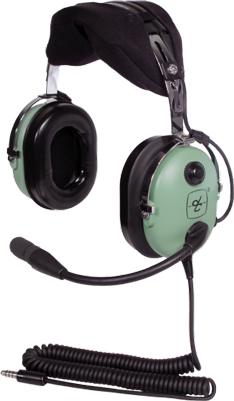
You are a GUI agent. You are given a task and a screenshot of the screen. Output one action in this format:
    pyautogui.click(x=<x>, y=<y>)
    Task: Click on the headphone set
    This screenshot has width=234, height=401.
    Given the screenshot: What is the action you would take?
    pyautogui.click(x=156, y=25)